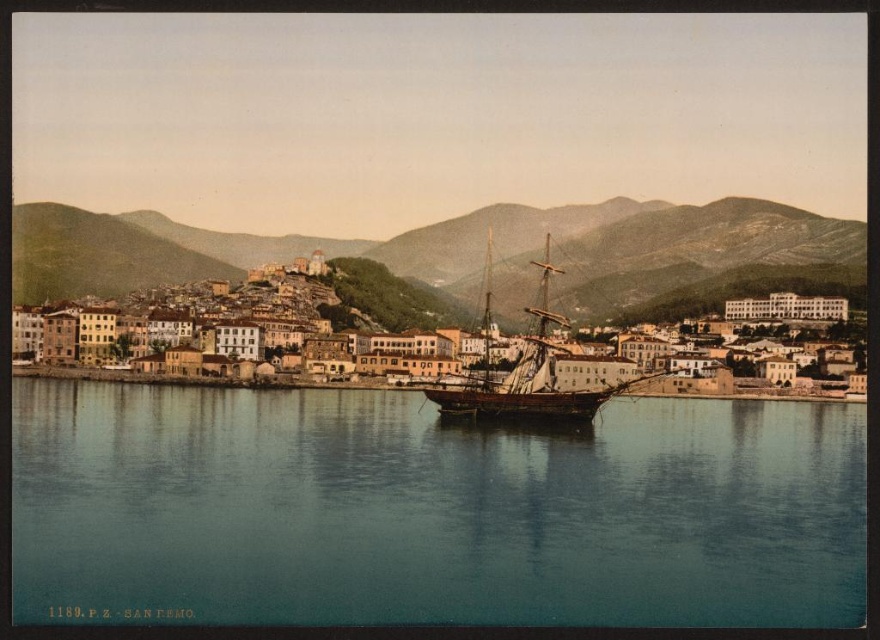
You are a photographer planning to capture the entire view of the coastal town. You notice the blue water at center and the rocky brown mountain at center in your frame. Which object appears narrower in the scene?

The blue water at center has a lesser width compared to the rocky brown mountain at center, so the blue water at center appears narrower.